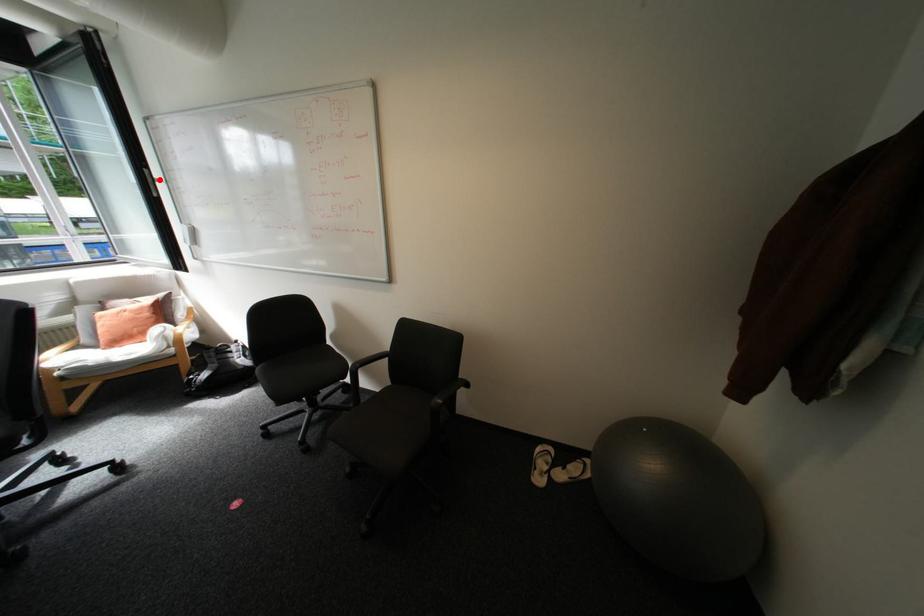
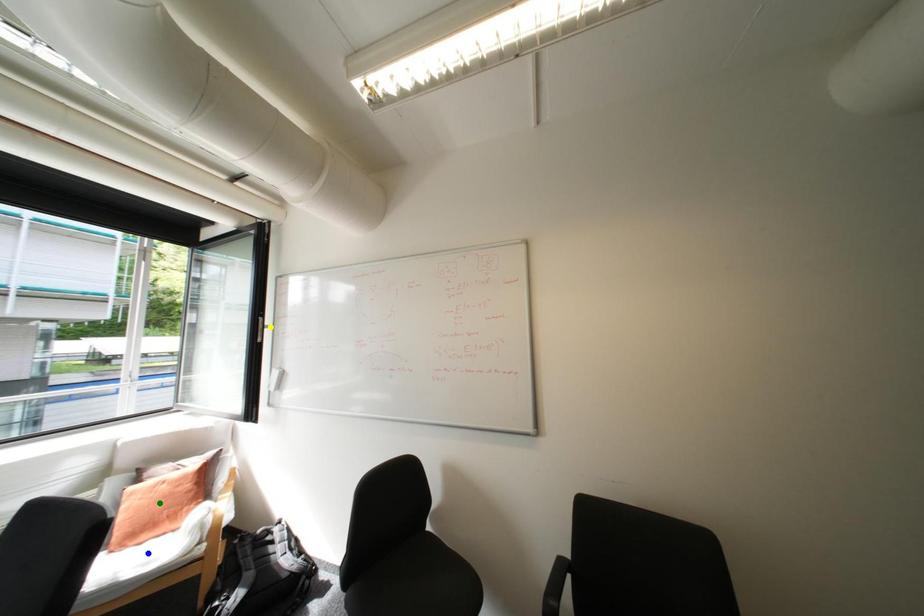
Question: I am providing you with two images of the same scene from different viewpoints. A red point is marked on the first image. You are given multiple points on the second image. Which point in image 2 represents the same 3d spot as the red point in image 1?

Choices:
 (A) green point
 (B) blue point
 (C) yellow point

Answer: (C)